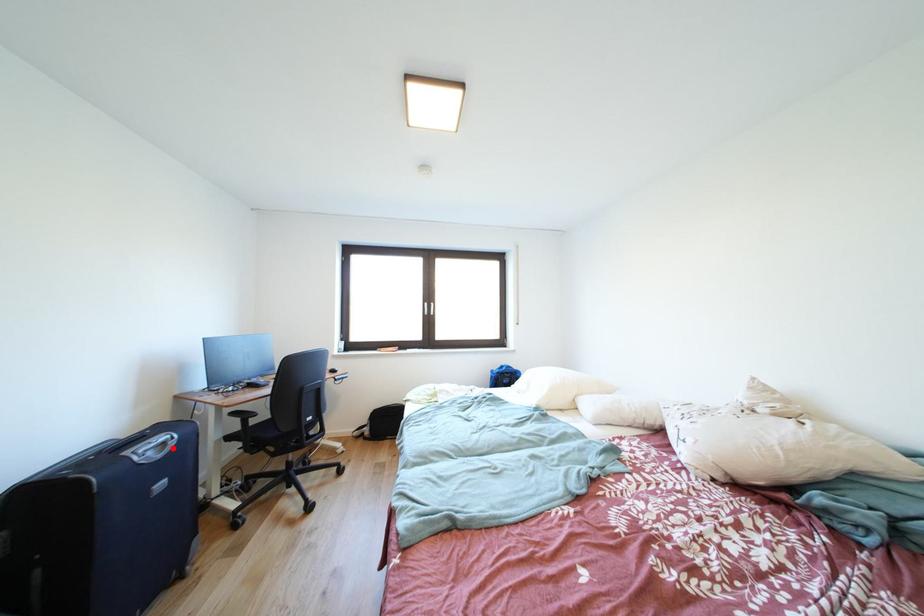
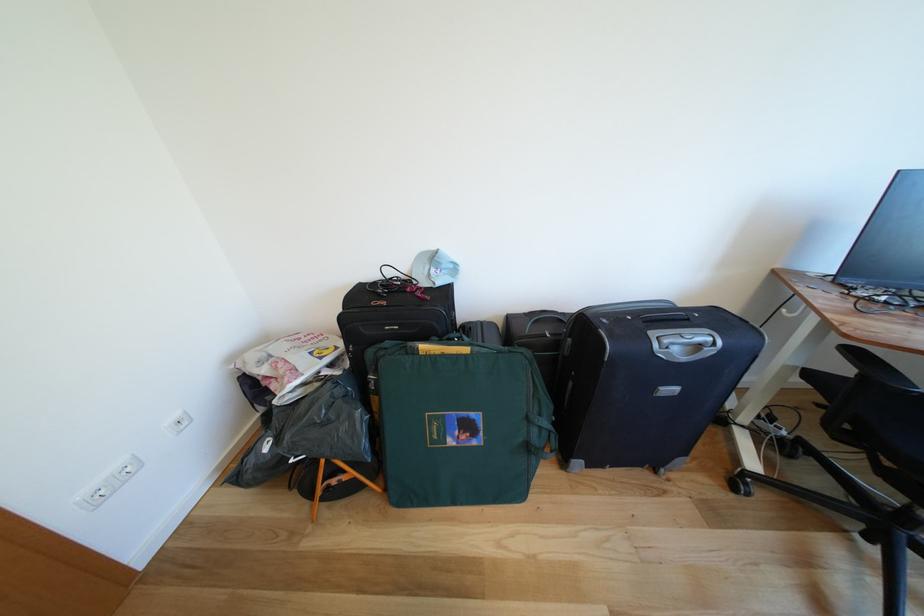
Find the pixel in the second image that matches the highlighted location in the first image.

(707, 351)